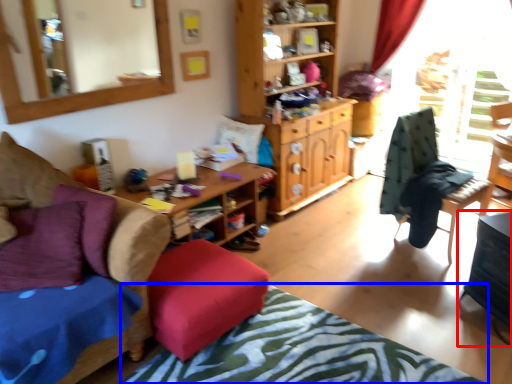
Question: Which of the following is the closest to the observer, table (highlighted by a red box) or bedcover (highlighted by a blue box)?

Choices:
 (A) table
 (B) bedcover

Answer: (B)